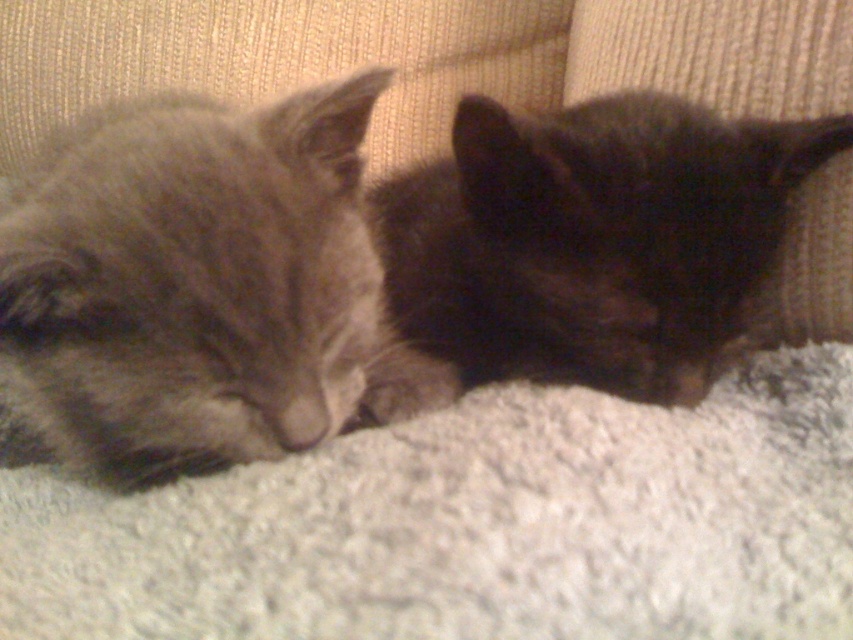
Does gray fur cat at left have a greater width compared to black fur cat at center?

In fact, gray fur cat at left might be narrower than black fur cat at center.

In the scene shown: Can you confirm if gray fur cat at left is positioned to the left of black fur cat at center?

Yes, gray fur cat at left is to the left of black fur cat at center.

The height and width of the screenshot is (640, 853). Describe the element at coordinates (202, 285) in the screenshot. I see `gray fur cat at left` at that location.

Locate an element on the screen. gray fur cat at left is located at coordinates (202, 285).